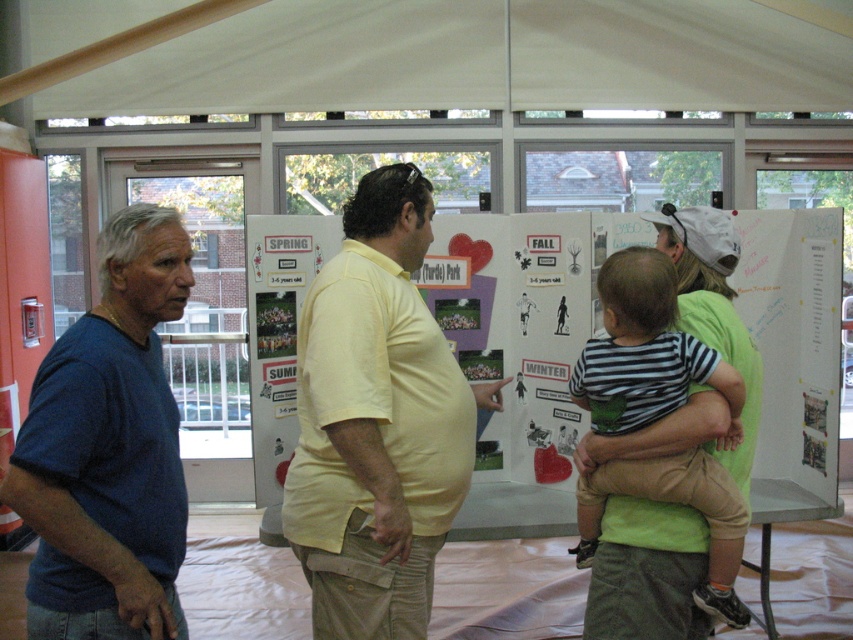
Can you confirm if yellow cotton shirt at center is positioned below blue cotton shirt at left?

Incorrect, yellow cotton shirt at center is not positioned below blue cotton shirt at left.

You are a GUI agent. You are given a task and a screenshot of the screen. Output one action in this format:
    pyautogui.click(x=<x>, y=<y>)
    Task: Click on the yellow cotton shirt at center
    This screenshot has height=640, width=853.
    Given the screenshot: What is the action you would take?
    pyautogui.click(x=376, y=420)

Locate an element on the screen. The image size is (853, 640). yellow cotton shirt at center is located at coordinates (376, 420).

How much distance is there between white fabric canopy at upper center and blue cotton shirt at left?

white fabric canopy at upper center is 3.90 meters from blue cotton shirt at left.

Does white fabric canopy at upper center have a smaller size compared to blue cotton shirt at left?

No.

Which is behind, point (741, 108) or point (167, 236)?

The point (741, 108) is behind.

Find the location of a particular element. This screenshot has width=853, height=640. white fabric canopy at upper center is located at coordinates (480, 58).

Does point (242, 26) lie in front of point (697, 358)?

No, it is behind (697, 358).

Is point (152, 86) farther from camera compared to point (721, 483)?

Yes, it is.

This screenshot has width=853, height=640. I want to click on white fabric canopy at upper center, so click(x=480, y=58).